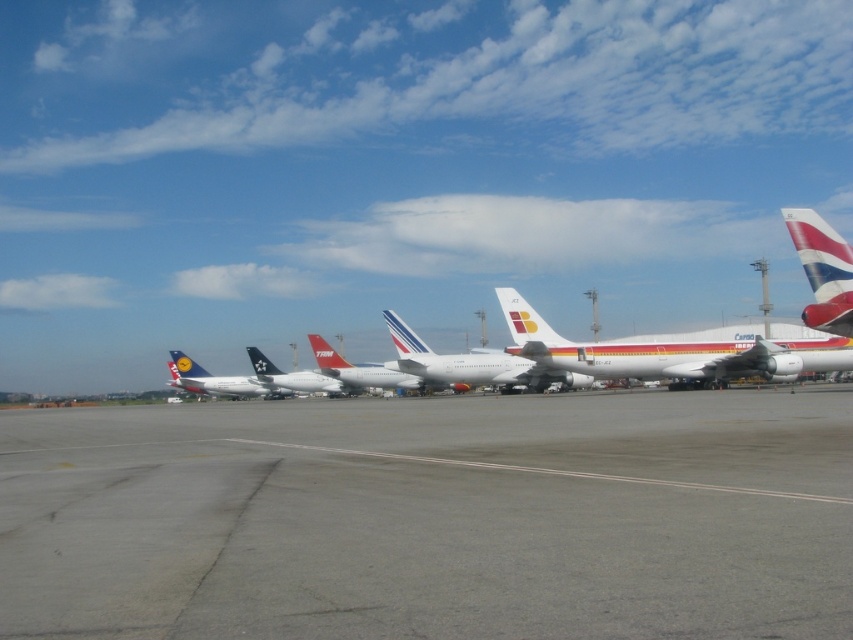
You are an airport maintenance worker needing to move a narrow equipment cart through the space between the white glossy airplane at center and the metallic silver airplane at left. Can the cart pass through the space between them?

The white glossy airplane at center is thinner than the metallic silver airplane at left, so the space between them may be sufficient for the narrow equipment cart to pass through, but the exact width isn